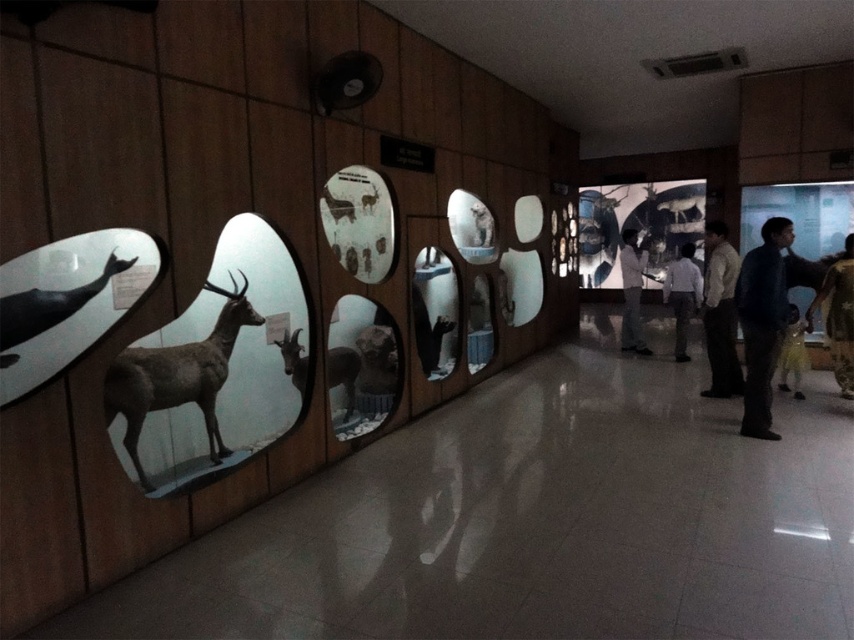
You are standing in front of the animal exhibits mounted on the wooden wall in the museum. There is a point at coordinate point (x=811, y=330). If you want to reach that point with your hand, will you be able to touch it without moving your feet? Please explain your answer based on the distance provided.

The point at coordinate point (x=811, y=330) is 5.50 meters away from you. Since the average arm length is about 0.7 meters, you cannot reach it without moving your feet.

You are standing in the museum exhibit described. You need to place a small 3D printed model of the yellow fabric dress at lower right exactly where it is displayed in the image. What coordinates should you use for placement?

The 2D location of the yellow fabric dress at lower right is at point (838, 316), so you should place the model at those coordinates.

You are a visitor standing in front of the museum exhibit. You notice a yellow fabric dress at lower right and a light blue shirt at center. Which clothing item is nearer to you?

The yellow fabric dress at lower right is closer to the viewer than the light blue shirt at center.